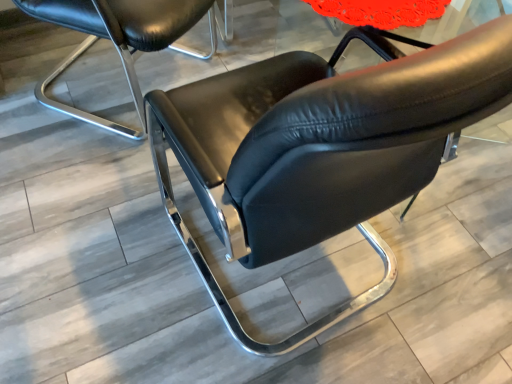
Question: Considering the relative positions of matte black chair at center, the 1th chair viewed from the left, and black leather chair at center, the 2th chair positioned from the left, in the image provided, is matte black chair at center, the 1th chair viewed from the left, to the left of black leather chair at center, the 2th chair positioned from the left, from the viewer's perspective?

Choices:
 (A) no
 (B) yes

Answer: (B)

Question: From the image's perspective, is matte black chair at center, which is the 2th chair from right to left, on top of black leather chair at center, the 2th chair positioned from the left?

Choices:
 (A) no
 (B) yes

Answer: (B)

Question: Does matte black chair at center, the 1th chair viewed from the left, contain black leather chair at center, the 2th chair positioned from the left?

Choices:
 (A) no
 (B) yes

Answer: (A)

Question: Is matte black chair at center, which is the 2th chair from right to left, facing towards black leather chair at center, the 2th chair positioned from the left?

Choices:
 (A) yes
 (B) no

Answer: (A)

Question: Can you confirm if matte black chair at center, which is the 2th chair from right to left, is bigger than black leather chair at center, placed as the first chair when sorted from right to left?

Choices:
 (A) yes
 (B) no

Answer: (B)

Question: Is matte black chair at center, the 1th chair viewed from the left, far away from black leather chair at center, placed as the first chair when sorted from right to left?

Choices:
 (A) yes
 (B) no

Answer: (B)

Question: Is black leather chair at center, the 2th chair positioned from the left, located outside matte black chair at center, which is the 2th chair from right to left?

Choices:
 (A) yes
 (B) no

Answer: (A)

Question: Is matte black chair at center, the 1th chair viewed from the left, a part of black leather chair at center, the 2th chair positioned from the left?

Choices:
 (A) no
 (B) yes

Answer: (A)

Question: Does black leather chair at center, placed as the first chair when sorted from right to left, have a lesser height compared to matte black chair at center, the 1th chair viewed from the left?

Choices:
 (A) no
 (B) yes

Answer: (A)

Question: Does black leather chair at center, the 2th chair positioned from the left, appear on the right side of matte black chair at center, which is the 2th chair from right to left?

Choices:
 (A) yes
 (B) no

Answer: (A)

Question: Is black leather chair at center, the 2th chair positioned from the left, facing away from matte black chair at center, the 1th chair viewed from the left?

Choices:
 (A) no
 (B) yes

Answer: (A)

Question: Are black leather chair at center, placed as the first chair when sorted from right to left, and matte black chair at center, the 1th chair viewed from the left, located far from each other?

Choices:
 (A) yes
 (B) no

Answer: (B)

Question: Considering the positions of black leather chair at center, the 2th chair positioned from the left, and matte black chair at center, the 1th chair viewed from the left, in the image, is black leather chair at center, the 2th chair positioned from the left, wider or thinner than matte black chair at center, the 1th chair viewed from the left,?

Choices:
 (A) wide
 (B) thin

Answer: (A)